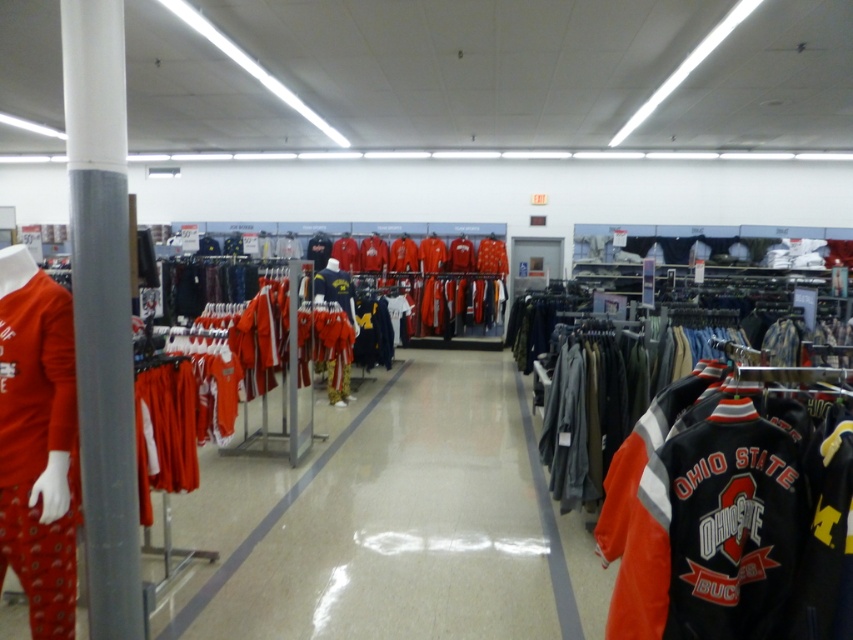
Is orange leather jacket at right above matte orange sweatshirt at left?

Actually, orange leather jacket at right is below matte orange sweatshirt at left.

Between orange leather jacket at right and matte orange sweatshirt at left, which one appears on the left side from the viewer's perspective?

matte orange sweatshirt at left is more to the left.

Which is behind, point (653, 477) or point (71, 438)?

The point (71, 438) is more distant.

Locate an element on the screen. orange leather jacket at right is located at coordinates (697, 522).

Find the location of a particular element. white glossy pole at left is located at coordinates (102, 308).

Who is more forward, (109,442) or (576,620)?

Positioned in front is point (109,442).

This screenshot has height=640, width=853. I want to click on white glossy pole at left, so click(x=102, y=308).

Who is shorter, orange fabric pants at center or matte gold sweatshirt at center?

With less height is orange fabric pants at center.

Between point (276, 516) and point (344, 288), which one is positioned behind?

Point (344, 288)

Identify the location of orange fabric pants at center. (270, 520).